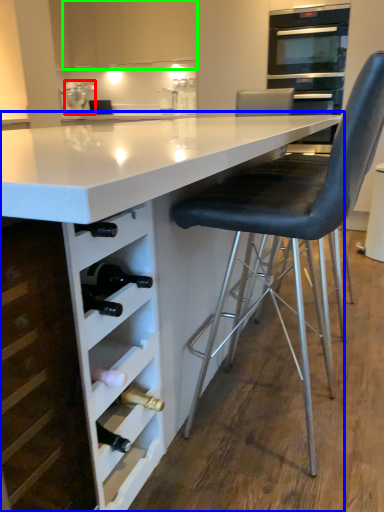
Question: Which object is the farthest from kitchen appliance (highlighted by a red box)? Choose among these: table (highlighted by a blue box) or cabinetry (highlighted by a green box).

Choices:
 (A) table
 (B) cabinetry

Answer: (A)